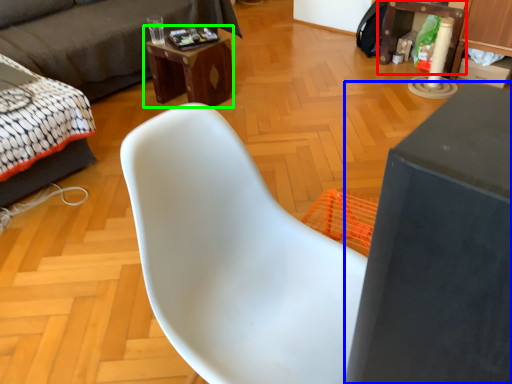
Question: Based on their relative distances, which object is farther from table (highlighted by a red box)? Choose from table (highlighted by a blue box) and desk (highlighted by a green box).

Choices:
 (A) table
 (B) desk

Answer: (A)